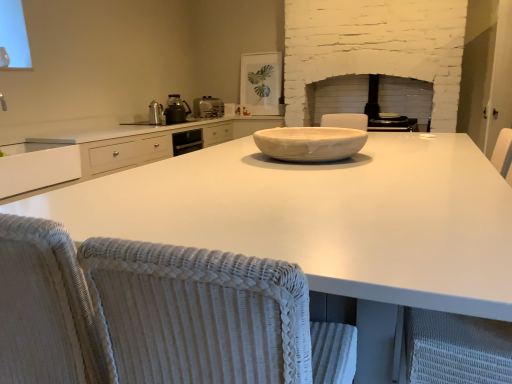
Question: Considering the relative positions of matte black toaster at center, placed as the third appliance when sorted from back to front, and metallic silver kettle at center-left, the 1th appliance viewed from the front, in the image provided, is matte black toaster at center, placed as the third appliance when sorted from back to front, to the left or to the right of metallic silver kettle at center-left, the 1th appliance viewed from the front,?

Choices:
 (A) left
 (B) right

Answer: (B)

Question: Is matte black toaster at center, placed as the first appliance when sorted from right to left, inside or outside of metallic silver kettle at center-left, the 1th appliance viewed from the front?

Choices:
 (A) inside
 (B) outside

Answer: (B)

Question: Based on their relative distances, which object is farther from the white woven armchair at right?

Choices:
 (A) white glossy countertop at center
 (B) matte white frame at upper center, the 1th appliance when ordered from back to front
 (C) satin silver toaster at upper center
 (D) white woven swivel chair at lower left
 (E) white matte cabinet at left

Answer: (C)

Question: Which is farther from the satin silver toaster at upper center?

Choices:
 (A) white marble bowl at center
 (B) matte black toaster at center, placed as the third appliance when sorted from back to front
 (C) white woven armchair at right
 (D) metallic black kettle at upper left, which is the 3th appliance in right-to-left order
 (E) metallic silver kettle at center-left, the fourth appliance from the back

Answer: (C)